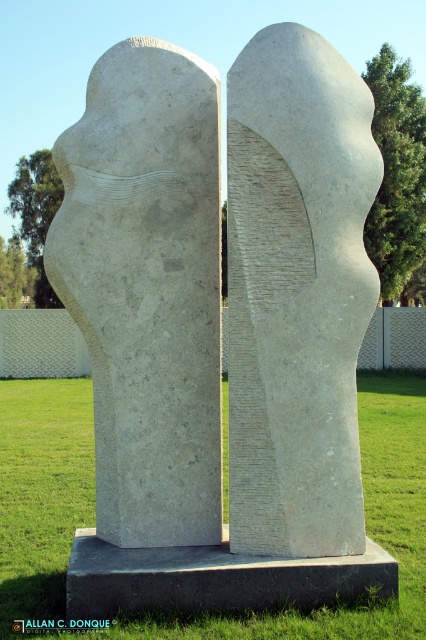
You are standing in the middle of the grassy area and see the green grass at center and the gray concrete at center. Which one is closer to your left side?

The green grass at center is to the left of gray concrete at center, so the green grass at center is closer to your left side.

You are standing in front of two sculptures in a park and want to take a photo. You notice two specific points on the sculptures marked as point 1 and point 2. If point 1 is at coordinates point (x=324, y=362) and point 2 is at point (x=383, y=604), which point will appear closer to the camera in your photo?

Point 1 at coordinates point (x=324, y=362) will appear closer to the camera than point 2 at point (x=383, y=604) because it is further to the camera.